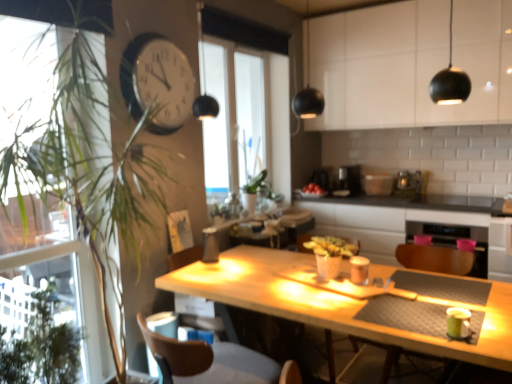
At what (x,y) coordinates should I click in order to perform the action: click on vacant region below satin silver toaster at center, marked as the second appliance in a left-to-right arrangement (from a real-world perspective). Please return your answer as a coordinate pair (x, y). Looking at the image, I should click on pyautogui.click(x=406, y=192).